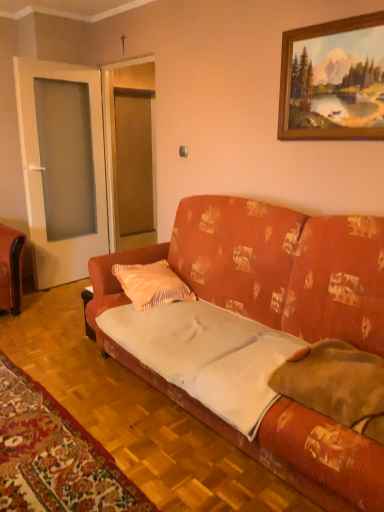
Question: Is textured orange couch at center inside orange velvet pillow at center, which is the first pillow in left-to-right order?

Choices:
 (A) no
 (B) yes

Answer: (A)

Question: Does orange velvet pillow at center, placed as the 1th pillow when sorted from back to front, have a greater width compared to textured orange couch at center?

Choices:
 (A) no
 (B) yes

Answer: (A)

Question: From the image's perspective, is orange velvet pillow at center, the 2th pillow in the right-to-left sequence, under textured orange couch at center?

Choices:
 (A) no
 (B) yes

Answer: (A)

Question: Is orange velvet pillow at center, the 2th pillow in the right-to-left sequence, far away from textured orange couch at center?

Choices:
 (A) no
 (B) yes

Answer: (A)

Question: From a real-world perspective, is orange velvet pillow at center, placed as the 1th pillow when sorted from back to front, over textured orange couch at center?

Choices:
 (A) yes
 (B) no

Answer: (B)

Question: From the image's perspective, is orange velvet pillow at center, the 2th pillow from the front, located above or below white cotton sheet at center?

Choices:
 (A) below
 (B) above

Answer: (B)

Question: In the image, is orange velvet pillow at center, the 2th pillow from the front, positioned in front of or behind white cotton sheet at center?

Choices:
 (A) behind
 (B) front

Answer: (A)

Question: From a real-world perspective, is orange velvet pillow at center, the 2th pillow from the front, physically located above or below white cotton sheet at center?

Choices:
 (A) below
 (B) above

Answer: (B)

Question: Is orange velvet pillow at center, the 2th pillow from the front, situated inside white cotton sheet at center or outside?

Choices:
 (A) inside
 (B) outside

Answer: (B)

Question: Is textured orange couch at center taller or shorter than wooden picture frame at upper right?

Choices:
 (A) short
 (B) tall

Answer: (B)

Question: Looking at the image, does textured orange couch at center seem bigger or smaller compared to wooden picture frame at upper right?

Choices:
 (A) big
 (B) small

Answer: (A)

Question: Considering their positions, is textured orange couch at center located in front of or behind wooden picture frame at upper right?

Choices:
 (A) front
 (B) behind

Answer: (A)

Question: From the image's perspective, is textured orange couch at center above or below wooden picture frame at upper right?

Choices:
 (A) below
 (B) above

Answer: (A)

Question: Is point (284, 74) positioned closer to the camera than point (94, 497)?

Choices:
 (A) farther
 (B) closer

Answer: (A)

Question: From the image's perspective, is wooden picture frame at upper right positioned above or below white fabric mat at lower left?

Choices:
 (A) above
 (B) below

Answer: (A)